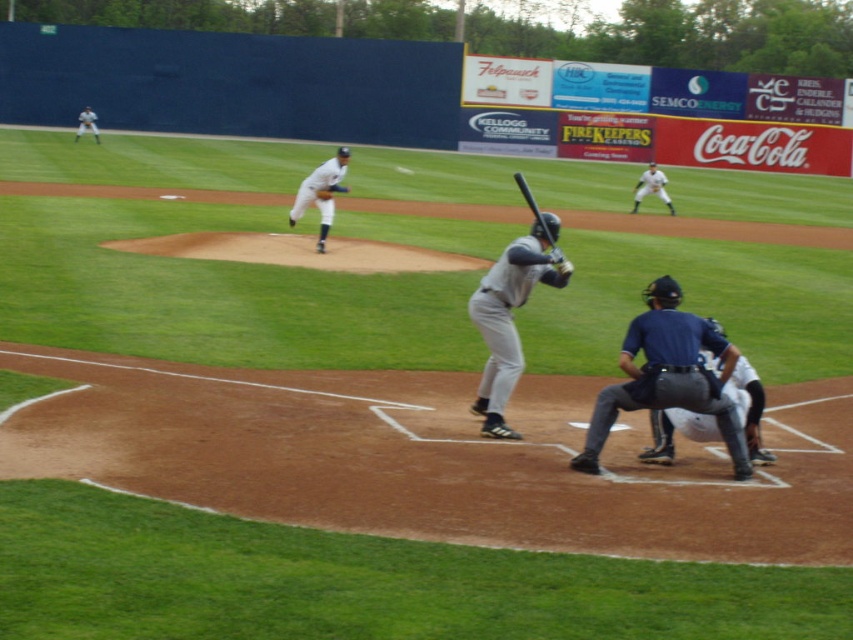
Question: Which object is farther from the camera taking this photo?

Choices:
 (A) dark blue padded uniform at lower center
 (B) dark blue uniform at lower right
 (C) white uniform at center
 (D) brown leather glove at center

Answer: (C)

Question: Is gray matte uniform at center smaller than brown leather glove at center?

Choices:
 (A) yes
 (B) no

Answer: (B)

Question: Which object is positioned closest to the gray matte uniform at center?

Choices:
 (A) dark blue padded uniform at lower center
 (B) brown leather glove at center
 (C) white matte baseball glove at upper center

Answer: (A)

Question: Considering the real-world distances, which object is closest to the brown leather glove at center?

Choices:
 (A) gray matte uniform at center
 (B) dark blue padded uniform at lower center

Answer: (A)

Question: Is white matte baseball glove at upper center further to the viewer compared to black matte bat at center?

Choices:
 (A) yes
 (B) no

Answer: (A)

Question: In this image, where is white uniform at upper right located relative to brown leather glove at center?

Choices:
 (A) above
 (B) below

Answer: (A)